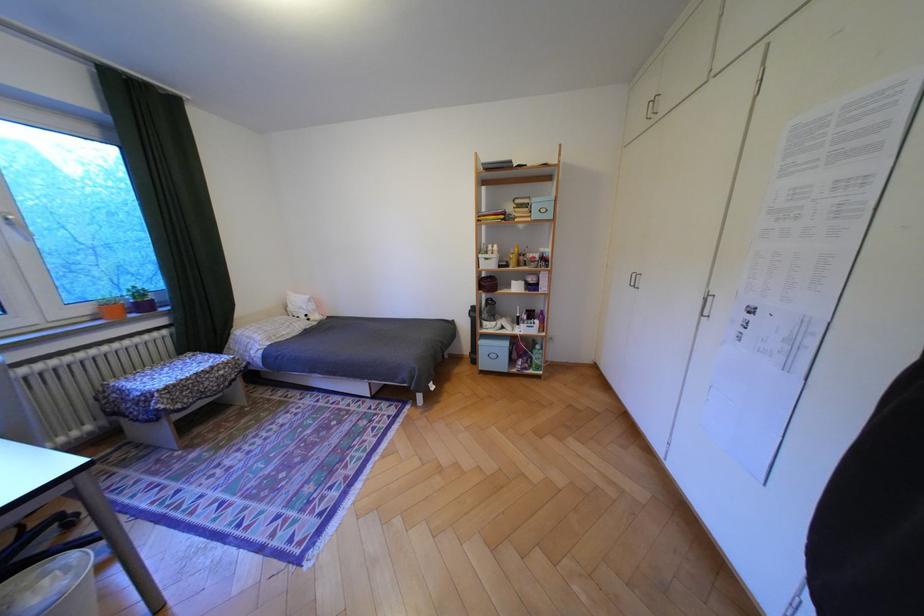
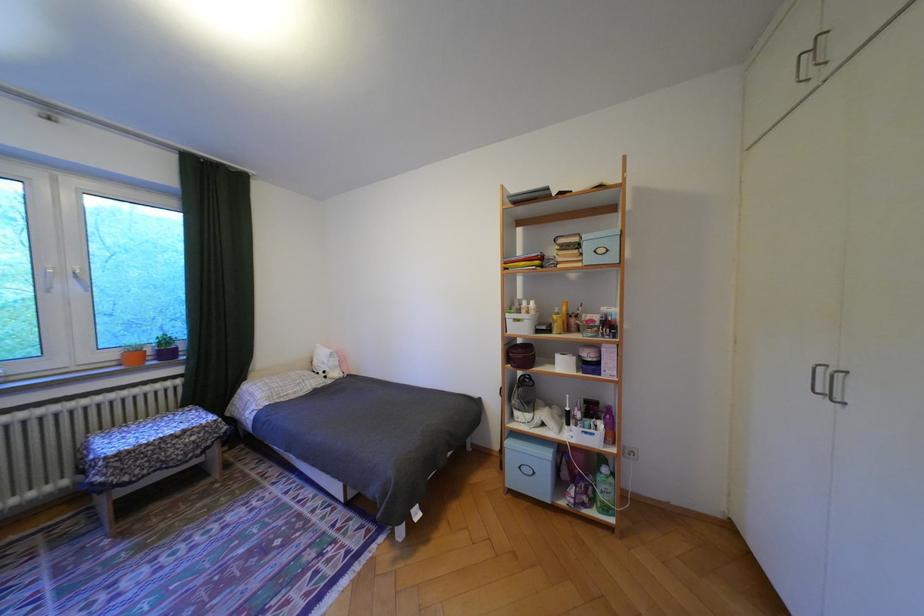
Where in the second image is the point corresponding to pixel 538 369 from the first image?

(596, 505)